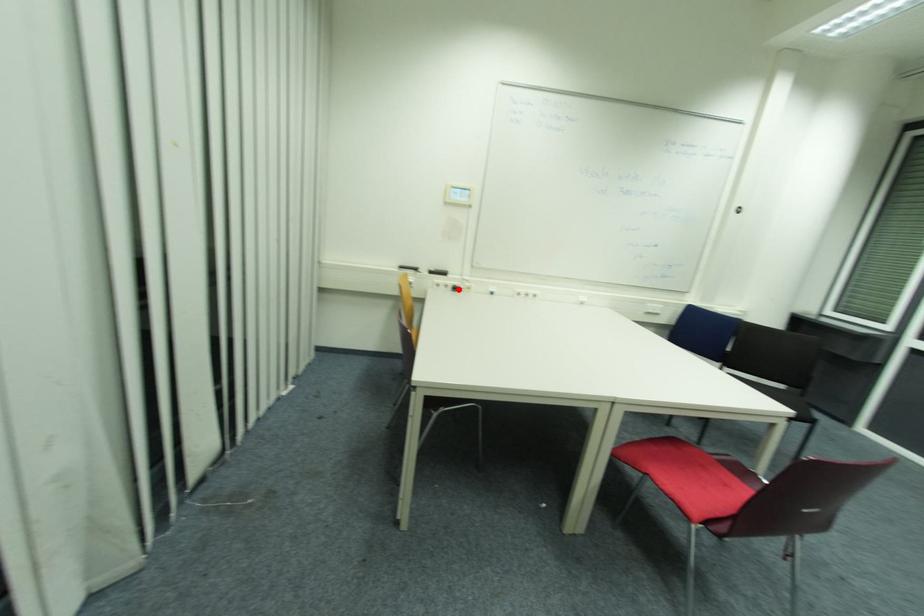
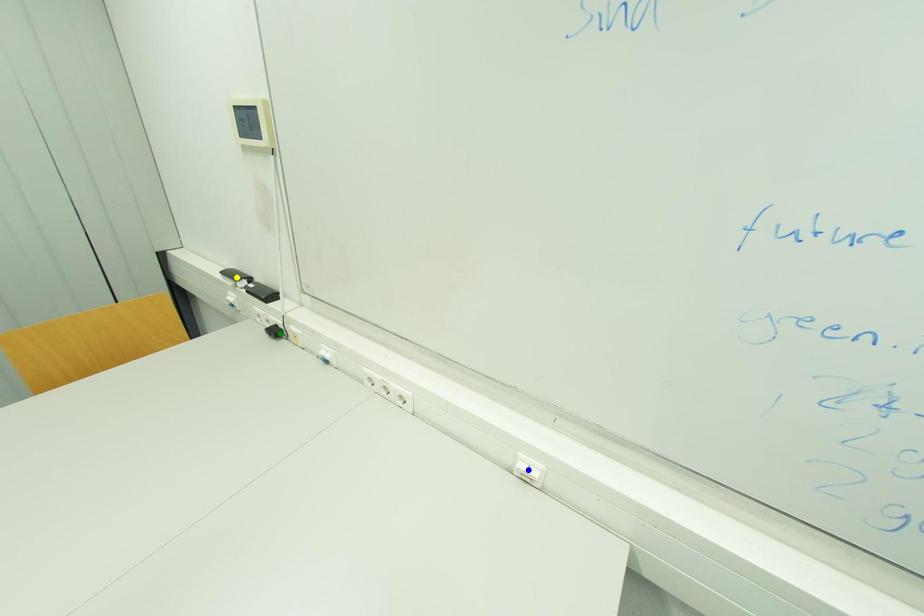
Question: I am providing you with two images of the same scene from different viewpoints. A red point is marked on the first image. You are given multiple points on the second image. Which spot in image 2 lines up with the point in image 1?

Choices:
 (A) green point
 (B) yellow point
 (C) blue point

Answer: (A)